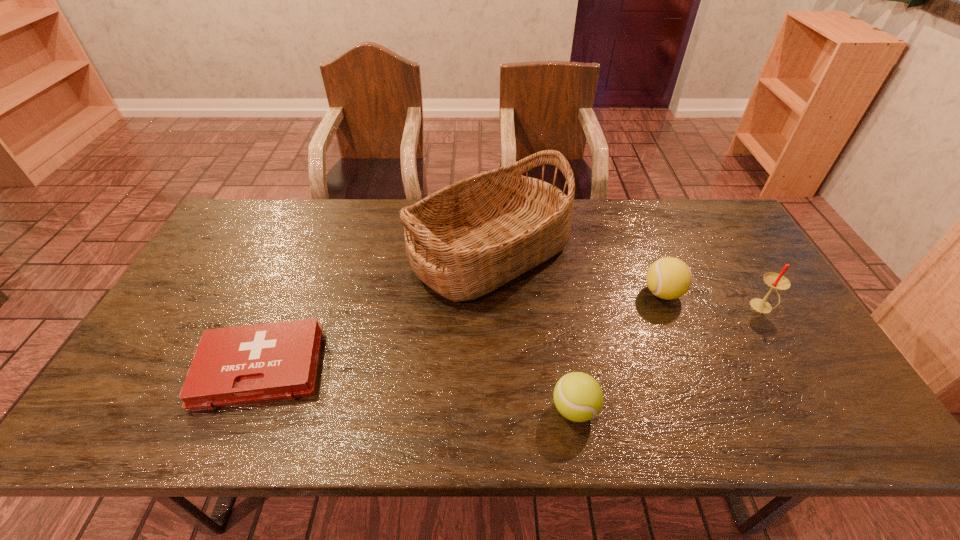
The height and width of the screenshot is (540, 960). I want to click on free spot that satisfies the following two spatial constraints: 1. on the front side of the second object from right to left; 2. on the right side of the tallest object, so click(x=491, y=293).

In order to click on free point that satisfies the following two spatial constraints: 1. on the front side of the tallest object; 2. on the right side of the right tennis ball in this screenshot , I will do `click(491, 293)`.